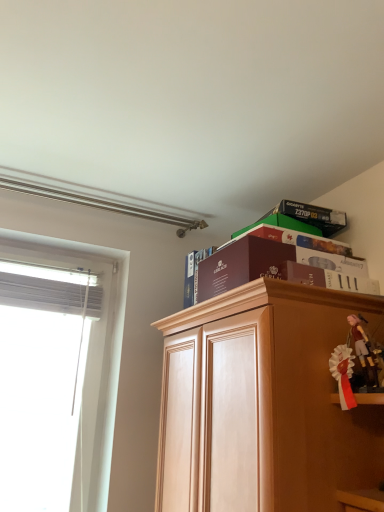
Describe the element at coordinates (362, 346) in the screenshot. The height and width of the screenshot is (512, 384). I see `pink fabric doll at upper right, which ranks as the first toy in right-to-left order` at that location.

The height and width of the screenshot is (512, 384). What do you see at coordinates (241, 265) in the screenshot?
I see `maroon cardboard box at upper center, positioned as the 1th paperback book in front-to-back order` at bounding box center [241, 265].

The width and height of the screenshot is (384, 512). What do you see at coordinates (58, 371) in the screenshot?
I see `white sheer curtain at left` at bounding box center [58, 371].

What are the coordinates of `white sheer curtain at left` in the screenshot? It's located at (58, 371).

Where is `white satin ribbon at right, the 2th toy from the right`? This screenshot has height=512, width=384. white satin ribbon at right, the 2th toy from the right is located at coordinates (343, 374).

Is maroon paper at upper center, the first paperback book from the back, looking in the opposite direction of pink fabric doll at upper right, which is counted as the 2th toy, starting from the left?

No, maroon paper at upper center, the first paperback book from the back, is not facing away from pink fabric doll at upper right, which is counted as the 2th toy, starting from the left.

Which paperback book is the 2nd one when counting from the back of the pink fabric doll at upper right, which is counted as the 2th toy, starting from the left? Please provide its 2D coordinates.

[(193, 274)]

How different are the orientations of maroon paper at upper center, the second paperback book from the front, and pink fabric doll at upper right, which is counted as the 2th toy, starting from the left, in degrees?

There is a 2.61-degree angle between the facing directions of maroon paper at upper center, the second paperback book from the front, and pink fabric doll at upper right, which is counted as the 2th toy, starting from the left.

From a real-world perspective, is maroon paper at upper center, the second paperback book from the front, physically above pink fabric doll at upper right, which ranks as the first toy in right-to-left order?

Yes, from a real-world perspective, maroon paper at upper center, the second paperback book from the front, is over pink fabric doll at upper right, which ranks as the first toy in right-to-left order

Is maroon cardboard box at upper center, positioned as the 1th paperback book in front-to-back order, positioned with its back to matte black box at upper right?

Yes, matte black box at upper right is at the back of maroon cardboard box at upper center, positioned as the 1th paperback book in front-to-back order.

Considering the positions of point (230, 269) and point (347, 256), is point (230, 269) closer or farther from the camera than point (347, 256)?

Point (230, 269) is positioned closer to the camera compared to point (347, 256).

Which object is closer to the camera, maroon cardboard box at upper center, the 2th paperback book positioned from the back, or matte black box at upper right?

Positioned in front is maroon cardboard box at upper center, the 2th paperback book positioned from the back.

From a real-world perspective, is white sheer curtain at left over maroon paper at upper center, the second paperback book from the front?

No, from a real-world perspective, white sheer curtain at left is not over maroon paper at upper center, the second paperback book from the front

Would you say white sheer curtain at left is inside or outside maroon paper at upper center, the first paperback book from the back?

The correct answer is: outside.

From the image's perspective, is white sheer curtain at left on maroon paper at upper center, the second paperback book from the front?

No, from the image's perspective, white sheer curtain at left is not above maroon paper at upper center, the second paperback book from the front.

Looking at their sizes, would you say white sheer curtain at left is wider or thinner than maroon paper at upper center, the first paperback book from the back?

Considering their sizes, white sheer curtain at left looks broader than maroon paper at upper center, the first paperback book from the back.

Which of these two, pink fabric doll at upper right, which is counted as the 2th toy, starting from the left, or maroon paper at upper center, the first paperback book from the back, is smaller?

Smaller between the two is pink fabric doll at upper right, which is counted as the 2th toy, starting from the left.

From the image's perspective, is pink fabric doll at upper right, which is counted as the 2th toy, starting from the left, located above or below maroon paper at upper center, the second paperback book from the front?

pink fabric doll at upper right, which is counted as the 2th toy, starting from the left, is situated lower than maroon paper at upper center, the second paperback book from the front, in the image.

Is pink fabric doll at upper right, which is counted as the 2th toy, starting from the left, outside of maroon paper at upper center, the second paperback book from the front?

Indeed, pink fabric doll at upper right, which is counted as the 2th toy, starting from the left, is completely outside maroon paper at upper center, the second paperback book from the front.

Find the location of a particular element. The width and height of the screenshot is (384, 512). paperback book behind the maroon cardboard box at upper center, positioned as the 1th paperback book in front-to-back order is located at coordinates [x=193, y=274].

Is maroon cardboard box at upper center, the 2th paperback book positioned from the back, spatially inside maroon paper at upper center, the second paperback book from the front, or outside of it?

maroon cardboard box at upper center, the 2th paperback book positioned from the back, lies outside maroon paper at upper center, the second paperback book from the front.

Is the surface of maroon cardboard box at upper center, the 2th paperback book positioned from the back, in direct contact with maroon paper at upper center, the second paperback book from the front?

They are not placed beside each other.

Between maroon cardboard box at upper center, positioned as the 1th paperback book in front-to-back order, and maroon paper at upper center, the first paperback book from the back, which one has less height?

With less height is maroon cardboard box at upper center, positioned as the 1th paperback book in front-to-back order.

Which is in front, point (328, 354) or point (235, 258)?

The point (328, 354) is closer to the camera.

Is light brown wood cabinet at upper right at the left side of maroon cardboard box at upper center, the 2th paperback book positioned from the back?

No.

From the picture: Is light brown wood cabinet at upper right closer to the viewer compared to maroon cardboard box at upper center, positioned as the 1th paperback book in front-to-back order?

Yes, light brown wood cabinet at upper right is closer to the camera.

Which of these two, matte black box at upper right or pink fabric doll at upper right, which is counted as the 2th toy, starting from the left, is wider?

matte black box at upper right.

Is matte black box at upper right next to pink fabric doll at upper right, which is counted as the 2th toy, starting from the left?

matte black box at upper right and pink fabric doll at upper right, which is counted as the 2th toy, starting from the left, are not in contact.

Is matte black box at upper right inside the boundaries of pink fabric doll at upper right, which ranks as the first toy in right-to-left order, or outside?

matte black box at upper right is not enclosed by pink fabric doll at upper right, which ranks as the first toy in right-to-left order.

Which paperback book is the 2nd one when counting from the left side of the pink fabric doll at upper right, which is counted as the 2th toy, starting from the left? Please provide its 2D coordinates.

[(193, 274)]

Find the location of a particular element. The width and height of the screenshot is (384, 512). the 2nd paperback book located beneath the matte black box at upper right (from a real-world perspective) is located at coordinates (241, 265).

Which object lies nearer to the anchor point light brown wood cabinet at upper right, white satin ribbon at right, the 2th toy from the right, or pink fabric doll at upper right, which ranks as the first toy in right-to-left order?

white satin ribbon at right, the 2th toy from the right, lies closer to light brown wood cabinet at upper right than the other object.

Which object lies nearer to the anchor point maroon paper at upper center, the first paperback book from the back, pink fabric doll at upper right, which ranks as the first toy in right-to-left order, or matte black box at upper right?

Among the two, matte black box at upper right is located nearer to maroon paper at upper center, the first paperback book from the back.

Based on their spatial positions, is maroon paper at upper center, the first paperback book from the back, or white sheer curtain at left closer to pink fabric doll at upper right, which is counted as the 2th toy, starting from the left?

maroon paper at upper center, the first paperback book from the back.

In the scene shown: From the image, which object appears to be farther from maroon paper at upper center, the first paperback book from the back, pink fabric doll at upper right, which ranks as the first toy in right-to-left order, or light brown wood cabinet at upper right?

pink fabric doll at upper right, which ranks as the first toy in right-to-left order, lies further to maroon paper at upper center, the first paperback book from the back, than the other object.

In the scene shown: Estimate the real-world distances between objects in this image. Which object is further from matte black box at upper right, white satin ribbon at right, marked as the 1th toy in a left-to-right arrangement, or white sheer curtain at left?

The object further to matte black box at upper right is white sheer curtain at left.

Based on their spatial positions, is white sheer curtain at left or maroon cardboard box at upper center, the 2th paperback book positioned from the back, further from pink fabric doll at upper right, which ranks as the first toy in right-to-left order?

Based on the image, white sheer curtain at left appears to be further to pink fabric doll at upper right, which ranks as the first toy in right-to-left order.

When comparing their distances from white satin ribbon at right, marked as the 1th toy in a left-to-right arrangement, does maroon cardboard box at upper center, the 2th paperback book positioned from the back, or pink fabric doll at upper right, which ranks as the first toy in right-to-left order, seem closer?

Among the two, pink fabric doll at upper right, which ranks as the first toy in right-to-left order, is located nearer to white satin ribbon at right, marked as the 1th toy in a left-to-right arrangement.

Based on their spatial positions, is maroon paper at upper center, the second paperback book from the front, or light brown wood cabinet at upper right closer to white sheer curtain at left?

maroon paper at upper center, the second paperback book from the front, is closer to white sheer curtain at left.

You are a GUI agent. You are given a task and a screenshot of the screen. Output one action in this format:
    pyautogui.click(x=<x>, y=<y>)
    Task: Click on the cabinetry located between white sheer curtain at left and matte black box at upper right in the left-right direction
    The width and height of the screenshot is (384, 512).
    Given the screenshot: What is the action you would take?
    pyautogui.click(x=262, y=402)

This screenshot has width=384, height=512. I want to click on book positioned between light brown wood cabinet at upper right and maroon paper at upper center, the second paperback book from the front, from near to far, so click(283, 254).

Locate an element on the screen. This screenshot has width=384, height=512. toy situated between white sheer curtain at left and pink fabric doll at upper right, which ranks as the first toy in right-to-left order, from left to right is located at coordinates (343, 374).

The width and height of the screenshot is (384, 512). I want to click on paperback book between white satin ribbon at right, the 2th toy from the right, and maroon paper at upper center, the first paperback book from the back, along the z-axis, so click(x=241, y=265).